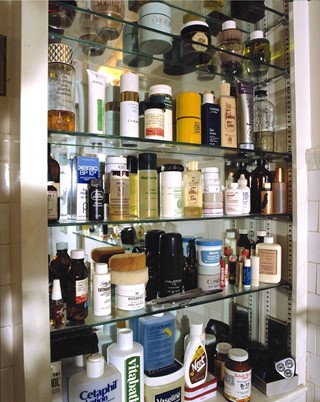
Where is `mirror`? The width and height of the screenshot is (320, 402). mirror is located at coordinates (90, 240), (212, 314), (144, 84), (174, 18).